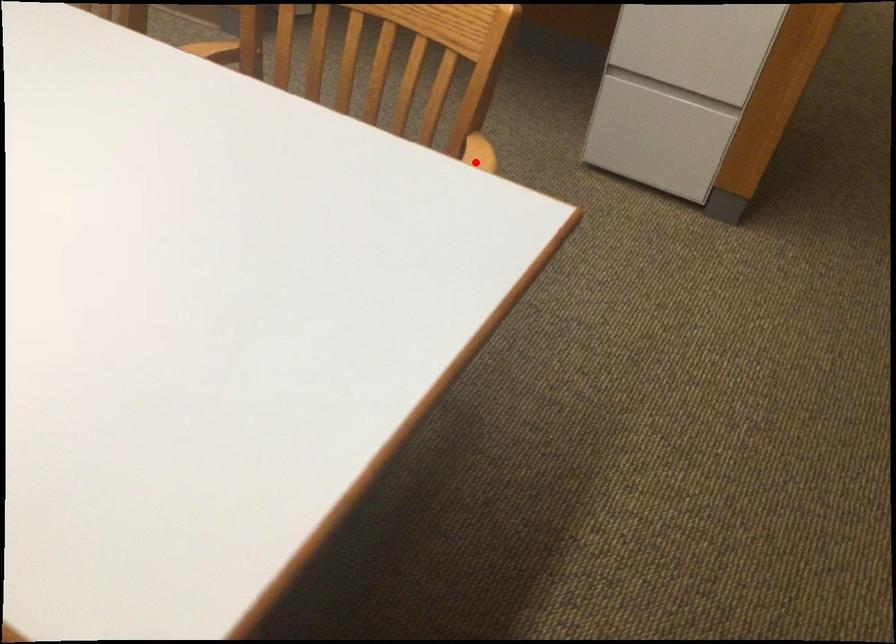
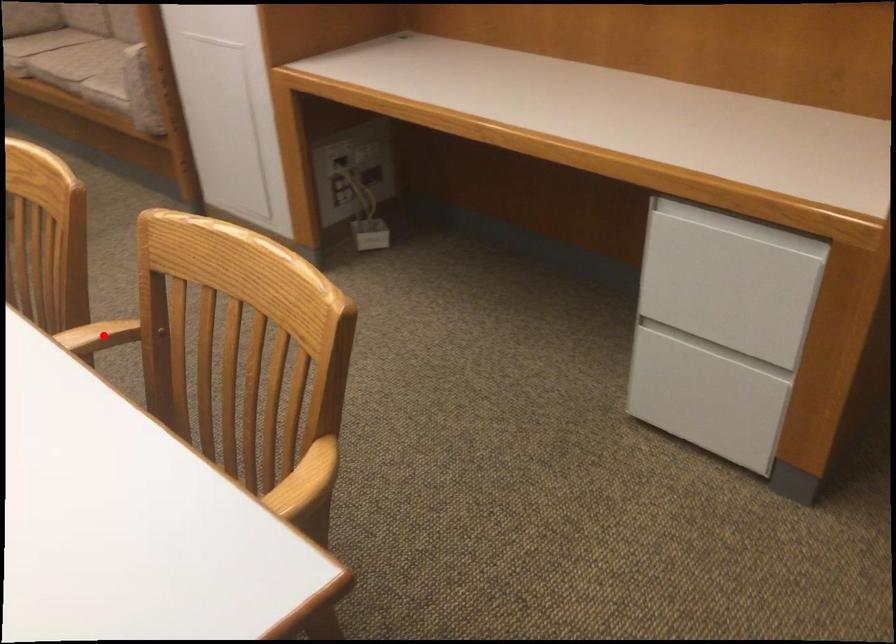
I am providing you with two images of the same scene from different viewpoints. A red point is marked on the first image and another point is marked on the second image. Does the point marked in image1 correspond to the same location as the one in image2?

No